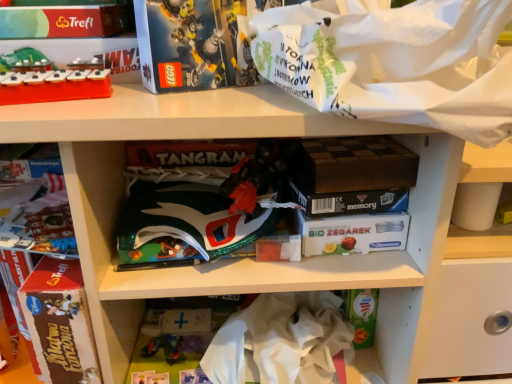
Question: Is shiny green plastic book at center at the right side of white crumpled paper at center?

Choices:
 (A) no
 (B) yes

Answer: (A)

Question: Considering the relative sizes of shiny green plastic book at center and white crumpled paper at center in the image provided, is shiny green plastic book at center taller than white crumpled paper at center?

Choices:
 (A) yes
 (B) no

Answer: (B)

Question: From a real-world perspective, is shiny green plastic book at center located higher than white crumpled paper at center?

Choices:
 (A) no
 (B) yes

Answer: (B)

Question: Is shiny green plastic book at center positioned with its back to white crumpled paper at center?

Choices:
 (A) no
 (B) yes

Answer: (A)

Question: Is shiny green plastic book at center shorter than white crumpled paper at center?

Choices:
 (A) yes
 (B) no

Answer: (A)

Question: Does shiny green plastic book at center have a larger size compared to white crumpled paper at center?

Choices:
 (A) yes
 (B) no

Answer: (B)

Question: Can you confirm if shiny green plastic book at center is positioned to the right of matte plastic xylophone at upper left?

Choices:
 (A) yes
 (B) no

Answer: (A)

Question: From a real-world perspective, is shiny green plastic book at center positioned under matte plastic xylophone at upper left based on gravity?

Choices:
 (A) yes
 (B) no

Answer: (A)

Question: Is shiny green plastic book at center turned away from matte plastic xylophone at upper left?

Choices:
 (A) yes
 (B) no

Answer: (B)

Question: From a real-world perspective, is shiny green plastic book at center positioned over matte plastic xylophone at upper left based on gravity?

Choices:
 (A) no
 (B) yes

Answer: (A)

Question: Is shiny green plastic book at center smaller than matte plastic xylophone at upper left?

Choices:
 (A) yes
 (B) no

Answer: (B)

Question: From the image's perspective, would you say shiny green plastic book at center is shown under matte plastic xylophone at upper left?

Choices:
 (A) no
 (B) yes

Answer: (B)

Question: From a real-world perspective, is shiny green plastic book at center positioned under white paper bag at upper right based on gravity?

Choices:
 (A) yes
 (B) no

Answer: (A)